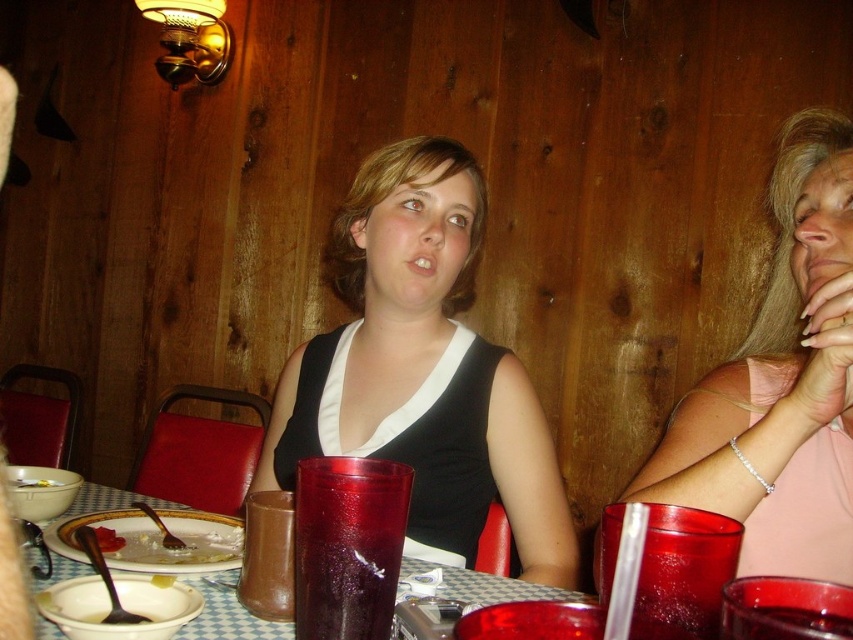
Question: Does translucent red glass at table center have a larger size compared to brown leather wallet at center?

Choices:
 (A) yes
 (B) no

Answer: (A)

Question: Among these objects, which one is nearest to the camera?

Choices:
 (A) pink fabric shirt at upper right
 (B) white creamy soup at lower left
 (C) brown leather wallet at center

Answer: (C)

Question: Which object is farther from the camera taking this photo?

Choices:
 (A) white creamy soup at lower left
 (B) translucent glass cup at center
 (C) translucent plastic cup at center
 (D) pink fabric shirt at upper right

Answer: (A)

Question: Which object is positioned farthest from the translucent glass cup at center?

Choices:
 (A) brown leather wallet at center
 (B) translucent red glass at table center

Answer: (B)

Question: Where is pink fabric shirt at upper right located in relation to translucent red glass at table center in the image?

Choices:
 (A) above
 (B) below

Answer: (A)

Question: In this image, where is white creamy soup at lower left located relative to smooth white plate at lower left?

Choices:
 (A) below
 (B) above

Answer: (A)